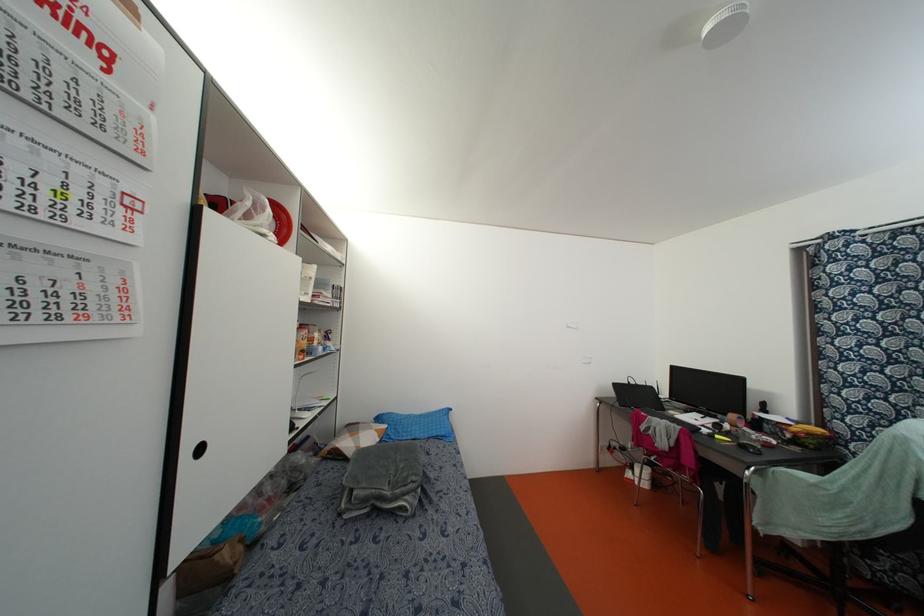
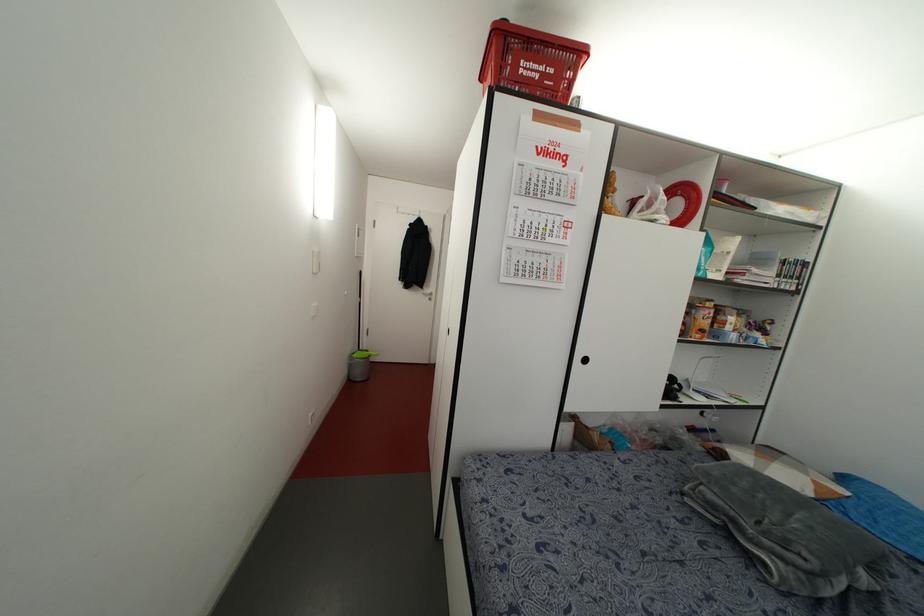
Question: The images are taken continuously from a first-person perspective. In which direction is your viewpoint rotating?

Choices:
 (A) Left
 (B) Right
 (C) Up
 (D) Down

Answer: (A)